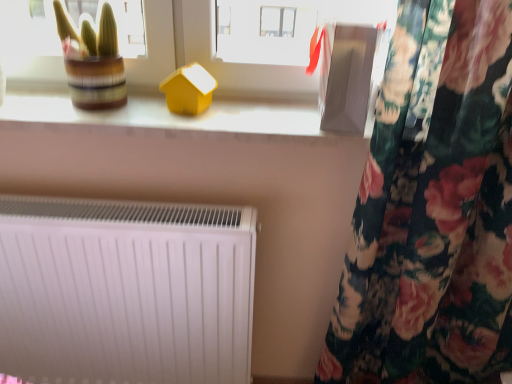
Question: Is matte yellow house at upper center inside the boundaries of matte yellow house at center, or outside?

Choices:
 (A) inside
 (B) outside

Answer: (B)

Question: Is matte yellow house at upper center bigger or smaller than matte yellow house at center?

Choices:
 (A) big
 (B) small

Answer: (A)

Question: Estimate the real-world distances between objects in this image. Which object is farther from the matte yellow house at upper center?

Choices:
 (A) matte yellow house at center
 (B) white matte radiator at lower left
 (C) green striped pot at upper left
 (D) white plastic house at upper center

Answer: (B)

Question: Based on their relative distances, which object is nearer to the white matte radiator at lower left?

Choices:
 (A) matte yellow house at upper center
 (B) green striped pot at upper left
 (C) white plastic house at upper center
 (D) matte yellow house at center

Answer: (A)